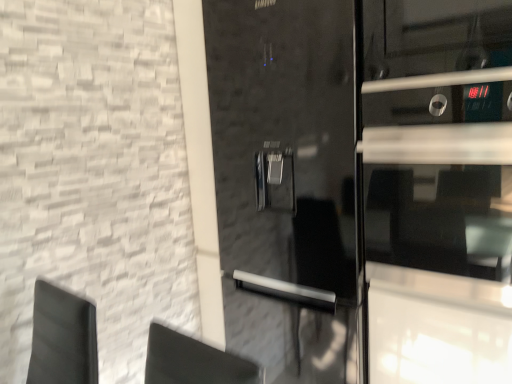
Locate an element on the screen. glossy black refrigerator at center is located at coordinates (282, 131).

This screenshot has height=384, width=512. What do you see at coordinates (282, 131) in the screenshot? I see `glossy black refrigerator at center` at bounding box center [282, 131].

I want to click on black glossy oven door at right, so click(x=437, y=191).

The height and width of the screenshot is (384, 512). Describe the element at coordinates (437, 191) in the screenshot. I see `black glossy oven door at right` at that location.

Image resolution: width=512 pixels, height=384 pixels. I want to click on glossy black refrigerator at center, so click(x=282, y=131).

Is black glossy oven door at right to the right of glossy black refrigerator at center from the viewer's perspective?

Correct, you'll find black glossy oven door at right to the right of glossy black refrigerator at center.

Is black glossy oven door at right in front of glossy black refrigerator at center?

Yes, black glossy oven door at right is closer to the camera.

Considering the points (495, 78) and (218, 83), which point is behind, point (495, 78) or point (218, 83)?

The point (218, 83) is behind.

From the image's perspective, which one is positioned higher, black glossy oven door at right or glossy black refrigerator at center?

black glossy oven door at right is shown above in the image.

From a real-world perspective, which object stands above the other?

In real-world perspective, black glossy oven door at right is above.

Which object is wider, black glossy oven door at right or glossy black refrigerator at center?

glossy black refrigerator at center.

From the picture: Which of these two, black glossy oven door at right or glossy black refrigerator at center, stands taller?

With more height is glossy black refrigerator at center.

Can you confirm if black glossy oven door at right is smaller than glossy black refrigerator at center?

Yes, black glossy oven door at right is smaller than glossy black refrigerator at center.

Is glossy black refrigerator at center surrounded by black glossy oven door at right?

Actually, glossy black refrigerator at center is outside black glossy oven door at right.

Is black glossy oven door at right far away from glossy black refrigerator at center?

No.

Could you tell me if black glossy oven door at right is facing glossy black refrigerator at center?

No.

The width and height of the screenshot is (512, 384). Identify the location of glass door on the right of glossy black refrigerator at center. (437, 191).

Does glossy black refrigerator at center appear on the right side of black glossy oven door at right?

No, glossy black refrigerator at center is not to the right of black glossy oven door at right.

Which object is closer to the camera taking this photo, glossy black refrigerator at center or black glossy oven door at right?

black glossy oven door at right is more forward.

Considering the points (333, 233) and (362, 341), which point is in front, point (333, 233) or point (362, 341)?

The point (362, 341) is in front.

From the image's perspective, which object appears higher, glossy black refrigerator at center or black glossy oven door at right?

black glossy oven door at right is shown above in the image.

From a real-world perspective, which is physically below, glossy black refrigerator at center or black glossy oven door at right?

glossy black refrigerator at center.

Does glossy black refrigerator at center have a greater width compared to black glossy oven door at right?

Indeed, glossy black refrigerator at center has a greater width compared to black glossy oven door at right.

Consider the image. Is glossy black refrigerator at center taller or shorter than black glossy oven door at right?

In the image, glossy black refrigerator at center appears to be taller than black glossy oven door at right.

Is glossy black refrigerator at center smaller than black glossy oven door at right?

Actually, glossy black refrigerator at center might be larger than black glossy oven door at right.

Consider the image. Is glossy black refrigerator at center inside the boundaries of black glossy oven door at right, or outside?

glossy black refrigerator at center is not enclosed by black glossy oven door at right.

Would you say glossy black refrigerator at center is a long distance from black glossy oven door at right?

Actually, glossy black refrigerator at center and black glossy oven door at right are a little close together.

Is glossy black refrigerator at center oriented towards black glossy oven door at right?

No, glossy black refrigerator at center is not aimed at black glossy oven door at right.

How different are the orientations of glossy black refrigerator at center and black glossy oven door at right in degrees?

There is a 7.94e-05-degree angle between the facing directions of glossy black refrigerator at center and black glossy oven door at right.

Where is `glass door on the right of the glossy black refrigerator at center`? The image size is (512, 384). glass door on the right of the glossy black refrigerator at center is located at coordinates (437, 191).

Image resolution: width=512 pixels, height=384 pixels. I want to click on glass door located above the glossy black refrigerator at center (from a real-world perspective), so click(437, 191).

Identify the location of glass door above the glossy black refrigerator at center (from the image's perspective). (437, 191).